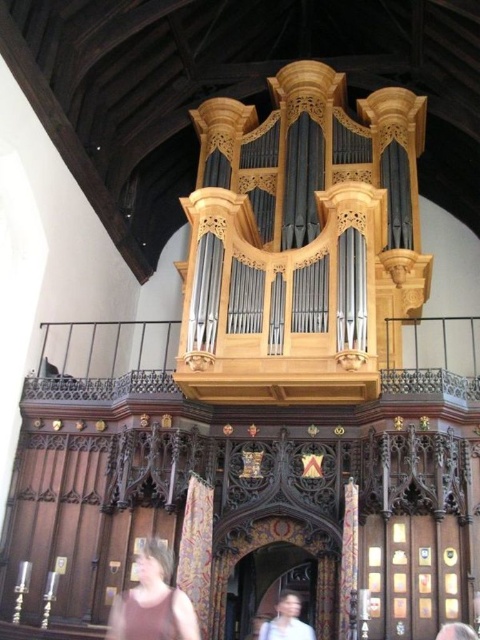
Question: Which of the following is the farthest from the observer?

Choices:
 (A) (273, 627)
 (B) (186, 637)

Answer: (A)

Question: Is brown textured shirt at lower center smaller than light brown hair at lower center?

Choices:
 (A) yes
 (B) no

Answer: (A)

Question: Is brown textured shirt at lower center wider than light brown hair at lower center?

Choices:
 (A) yes
 (B) no

Answer: (A)

Question: Which point appears farthest from the camera in this image?

Choices:
 (A) (274, 627)
 (B) (148, 561)

Answer: (A)

Question: Can you confirm if brown textured shirt at lower center is thinner than light brown hair at lower center?

Choices:
 (A) yes
 (B) no

Answer: (B)